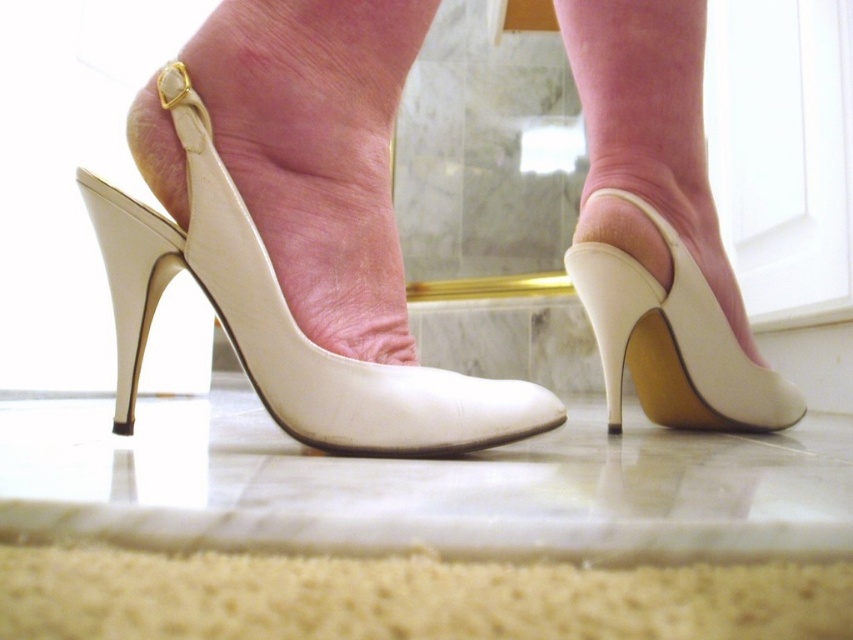
You are a photographer setting up a shoot in a bathroom. You have two objects in focus here, the white leather shoe at center and the white leather high heel at center. From the photographer perspective, which object is positioned more to the left?

The white leather shoe at center is positioned more to the left than the white leather high heel at center.

You are a photographer setting up a shoot in a bathroom. You have two white leather shoe at center to place on the marble floor. The client wants them to be positioned exactly 20 inches apart for the shot. Based on the current setup, will you need to adjust their positions?

The white leather shoe at center are currently 19.41 inches apart. Since the client requested 20 inches, you need to move them slightly further apart to meet the requirement.

From the picture: You are designing a shoe display stand and need to ensure it accommodates both the white leather shoe at center and the white leather high heel at center. Based on their sizes, which one requires a taller compartment?

The white leather high heel at center requires a taller compartment because it is taller than the white leather shoe at center.